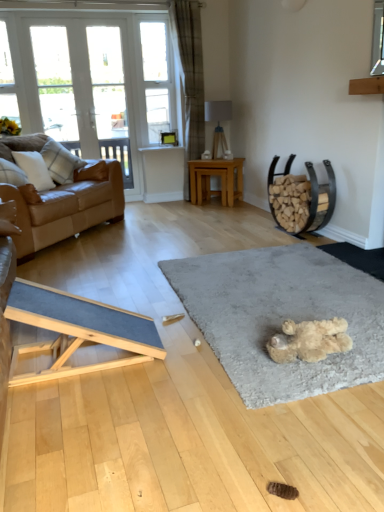
Question: Can you confirm if white glass door at upper left, arranged as the 1th window when viewed from the right, is thinner than white glass door at upper left, marked as the second window in a left-to-right arrangement?

Choices:
 (A) yes
 (B) no

Answer: (A)

Question: Considering the relative sizes of white glass door at upper left, arranged as the 1th window when viewed from the right, and white glass door at upper left, marked as the second window in a left-to-right arrangement, in the image provided, is white glass door at upper left, arranged as the 1th window when viewed from the right, shorter than white glass door at upper left, marked as the second window in a left-to-right arrangement,?

Choices:
 (A) no
 (B) yes

Answer: (A)

Question: From a real-world perspective, is white glass door at upper left, acting as the 3th window starting from the left, physically below white glass door at upper left, acting as the second window starting from the right?

Choices:
 (A) yes
 (B) no

Answer: (A)

Question: Is white glass door at upper left, acting as the second window starting from the right, a part of white glass door at upper left, acting as the 3th window starting from the left?

Choices:
 (A) yes
 (B) no

Answer: (A)

Question: From the image's perspective, is white glass door at upper left, acting as the 3th window starting from the left, under white glass door at upper left, acting as the second window starting from the right?

Choices:
 (A) no
 (B) yes

Answer: (B)

Question: Is point (11, 101) positioned closer to the camera than point (259, 372)?

Choices:
 (A) closer
 (B) farther

Answer: (B)

Question: In terms of height, does white glass window at upper left, the 1th window positioned from the left, look taller or shorter compared to soft gray carpet at center?

Choices:
 (A) short
 (B) tall

Answer: (B)

Question: Is white glass window at upper left, the 1th window positioned from the left, to the left or to the right of soft gray carpet at center in the image?

Choices:
 (A) left
 (B) right

Answer: (A)

Question: From the image's perspective, is white glass window at upper left, the third window viewed from the right, located above or below soft gray carpet at center?

Choices:
 (A) below
 (B) above

Answer: (B)

Question: Is white glass screen door at upper left wider or thinner than white glass door at upper left, arranged as the 1th window when viewed from the right?

Choices:
 (A) wide
 (B) thin

Answer: (A)

Question: In the image, is white glass screen door at upper left positioned in front of or behind white glass door at upper left, acting as the 3th window starting from the left?

Choices:
 (A) front
 (B) behind

Answer: (B)

Question: From a real-world perspective, is white glass screen door at upper left positioned above or below white glass door at upper left, acting as the 3th window starting from the left?

Choices:
 (A) below
 (B) above

Answer: (B)

Question: From the image's perspective, is white glass screen door at upper left above or below white glass door at upper left, acting as the 3th window starting from the left?

Choices:
 (A) above
 (B) below

Answer: (A)

Question: From a real-world perspective, is soft gray carpet at center positioned above or below clear glass window screen at upper center?

Choices:
 (A) below
 (B) above

Answer: (A)

Question: Which is correct: soft gray carpet at center is inside clear glass window screen at upper center, or outside of it?

Choices:
 (A) inside
 (B) outside

Answer: (B)